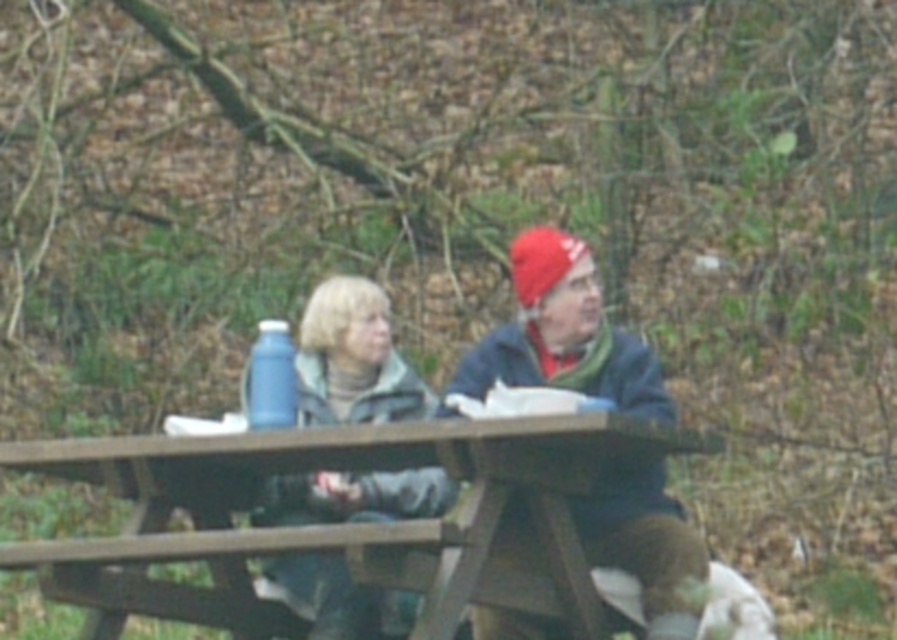
Find the location of a particular element. The image size is (897, 640). matte gray jacket at center is located at coordinates (353, 358).

Which is behind, point (333, 352) or point (268, 337)?

The point (333, 352) is more distant.

The width and height of the screenshot is (897, 640). I want to click on matte gray jacket at center, so click(x=353, y=358).

Which is above, wooden picnic table at center or matte blue thermos at center?

matte blue thermos at center

Can you confirm if wooden picnic table at center is wider than matte blue thermos at center?

Yes.

At what (x,y) coordinates should I click in order to perform the action: click on wooden picnic table at center. Please return your answer as a coordinate pair (x, y). The image size is (897, 640). Looking at the image, I should click on click(x=336, y=524).

Does matte blue thermos at center have a larger size compared to blue plastic bottle at center?

Yes.

Who is lower down, matte blue thermos at center or blue plastic bottle at center?

matte blue thermos at center is lower down.

This screenshot has height=640, width=897. Find the location of `matte blue thermos at center`. matte blue thermos at center is located at coordinates (563, 333).